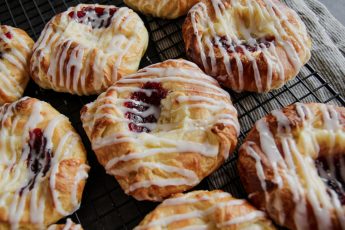
Where is `cooling rack`? This screenshot has height=230, width=345. cooling rack is located at coordinates (305, 92).